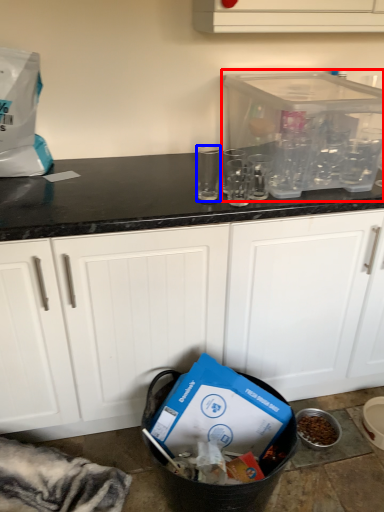
Question: Among these objects, which one is nearest to the camera, appliance (highlighted by a red box) or clear (highlighted by a blue box)?

Choices:
 (A) appliance
 (B) clear

Answer: (A)